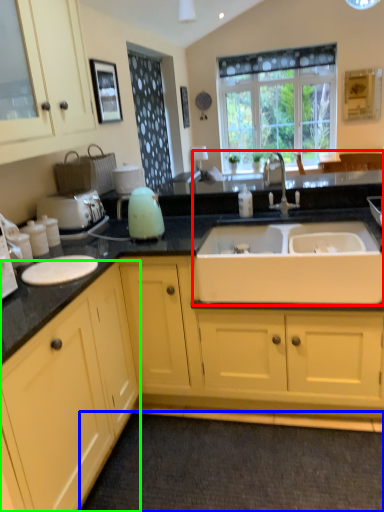
Question: Considering the real-world distances, which object is closest to sink (highlighted by a red box)? plain (highlighted by a blue box) or cabinetry (highlighted by a green box).

Choices:
 (A) plain
 (B) cabinetry

Answer: (B)